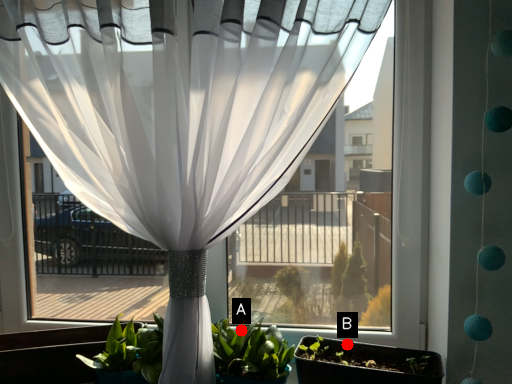
Question: Two points are circled on the image, labeled by A and B beside each circle. Which point is closer to the camera?

Choices:
 (A) A is closer
 (B) B is closer

Answer: (A)